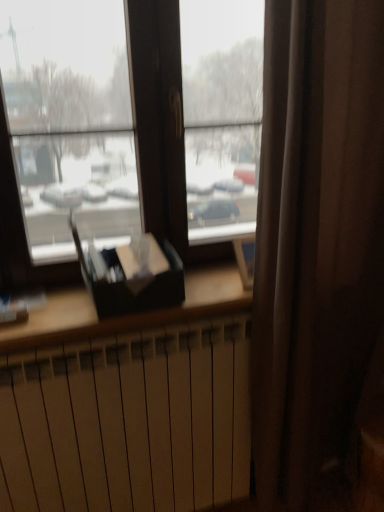
Question: Is matte black book at center outside of white matte radiator at lower center?

Choices:
 (A) yes
 (B) no

Answer: (A)

Question: Is matte black book at center further to the viewer compared to white matte radiator at lower center?

Choices:
 (A) no
 (B) yes

Answer: (B)

Question: Does matte black book at center have a lesser width compared to white matte radiator at lower center?

Choices:
 (A) yes
 (B) no

Answer: (B)

Question: Is matte black book at center in front of white matte radiator at lower center?

Choices:
 (A) no
 (B) yes

Answer: (A)

Question: Can you confirm if matte black book at center is positioned to the left of white matte radiator at lower center?

Choices:
 (A) no
 (B) yes

Answer: (B)

Question: Can you confirm if matte black book at center is positioned to the right of white matte radiator at lower center?

Choices:
 (A) yes
 (B) no

Answer: (B)

Question: Considering the relative sizes of white matte radiator at lower center and matte black book at center in the image provided, is white matte radiator at lower center smaller than matte black book at center?

Choices:
 (A) yes
 (B) no

Answer: (B)

Question: From a real-world perspective, is white matte radiator at lower center beneath matte black book at center?

Choices:
 (A) yes
 (B) no

Answer: (A)

Question: Considering the relative sizes of white matte radiator at lower center and matte black book at center in the image provided, is white matte radiator at lower center taller than matte black book at center?

Choices:
 (A) yes
 (B) no

Answer: (A)

Question: Can you confirm if white matte radiator at lower center is positioned to the left of matte black book at center?

Choices:
 (A) no
 (B) yes

Answer: (A)

Question: From the image's perspective, does white matte radiator at lower center appear higher than matte black book at center?

Choices:
 (A) no
 (B) yes

Answer: (A)

Question: Does white matte radiator at lower center have a lesser width compared to matte black book at center?

Choices:
 (A) yes
 (B) no

Answer: (A)

Question: From the image's perspective, relative to white matte radiator at lower center, is matte black book at center above or below?

Choices:
 (A) below
 (B) above

Answer: (B)